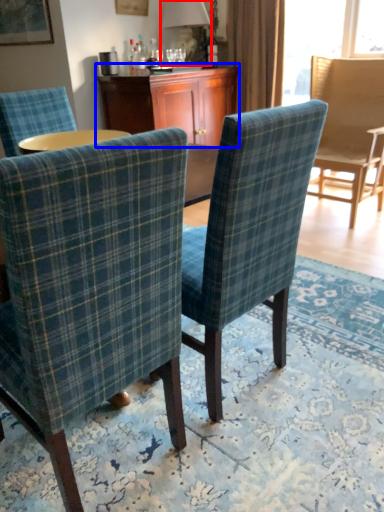
Question: Among these objects, which one is farthest to the camera, lamp (highlighted by a red box) or desk (highlighted by a blue box)?

Choices:
 (A) lamp
 (B) desk

Answer: (A)